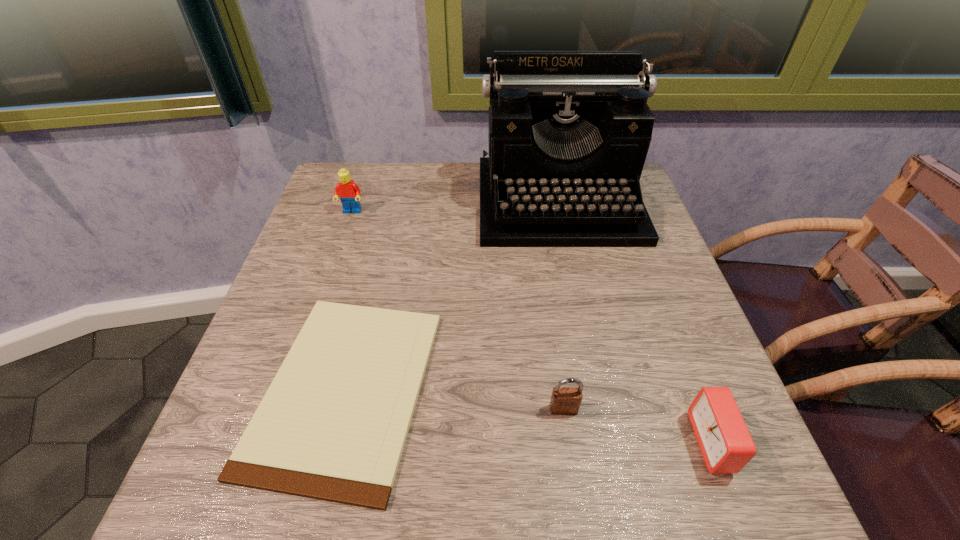
Locate an element on the screen. object that stands as the fourth closest to the alarm clock is located at coordinates (349, 193).

Locate which object is the fourth closest to the typewriter. Please provide its 2D coordinates. Your answer should be formatted as a tuple, i.e. [(x, y)], where the tuple contains the x and y coordinates of a point satisfying the conditions above.

[(725, 442)]